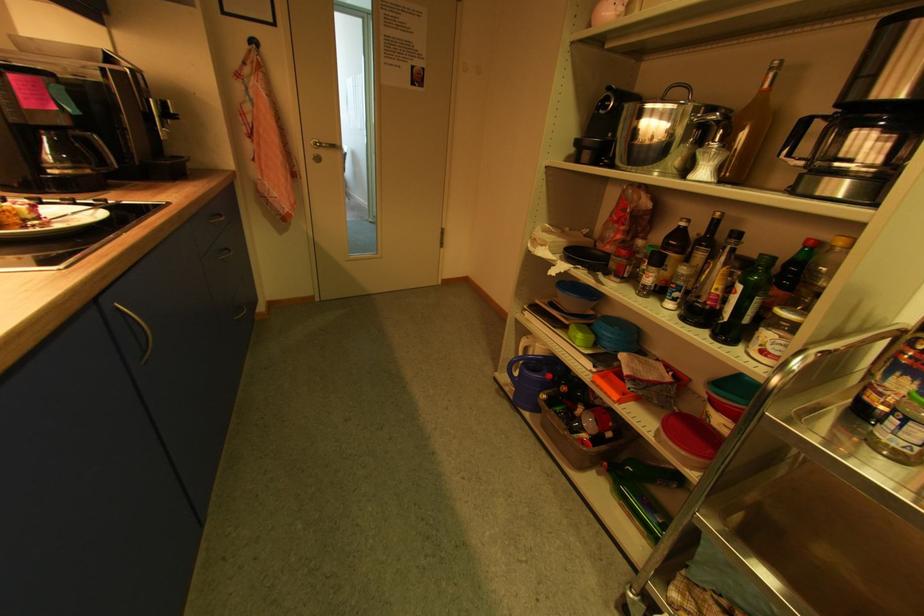
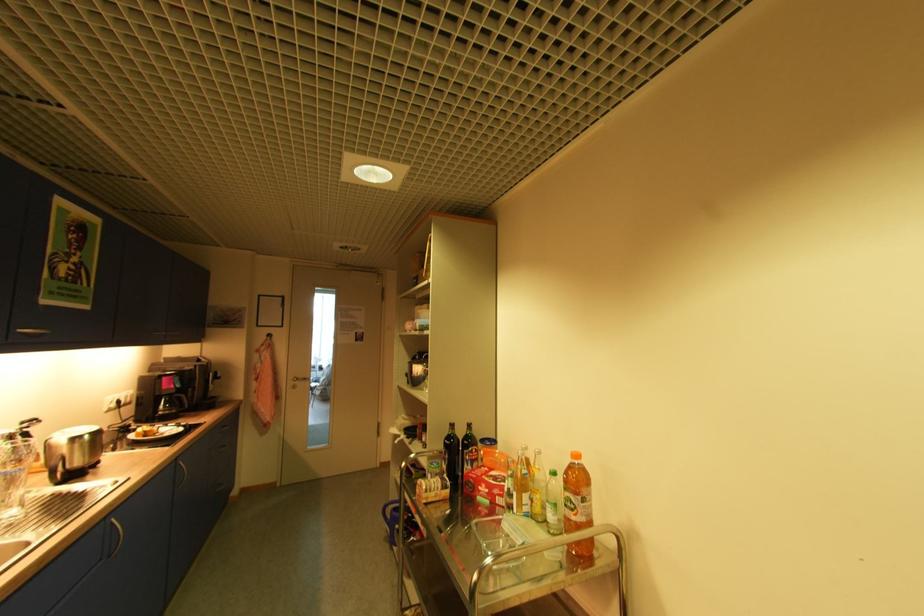
Find the pixel in the second image that matches pixel 69 124 in the first image.

(178, 392)